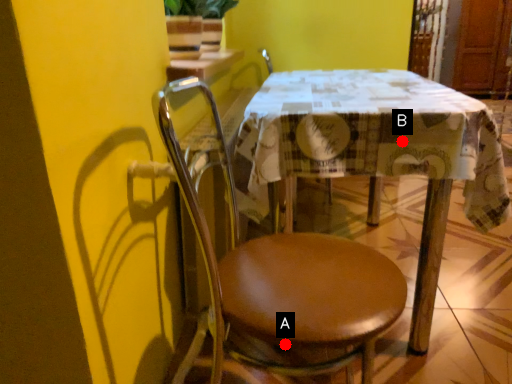
Question: Two points are circled on the image, labeled by A and B beside each circle. Which of the following is the farthest from the observer?

Choices:
 (A) A is further
 (B) B is further

Answer: (A)